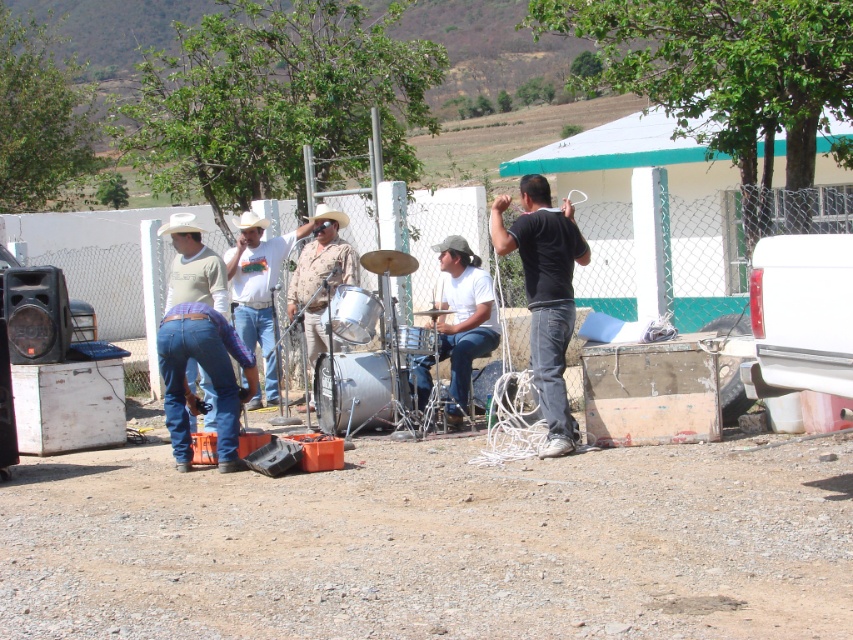
You are a photographer trying to capture the performer in the center of the image. There is a point marked at coordinates (544, 292). What is the performer wearing at that location?

The performer is wearing a black matte shirt at the point marked (544, 292).

You are standing at the origin point in the image. Where is the black matte shirt at center located in terms of coordinates?

The black matte shirt at center is located at coordinates point 0.459 on the x axis and 0.640 on the y axis.

You are organizing a small outdoor concert and need to arrange the black matte shirt at center and the white matte drum at center. Given their sizes, which object should be placed first to ensure proper spacing?

The black matte shirt at center has a larger width than the white matte drum at center, so it should be placed first to ensure there is enough space for both objects.